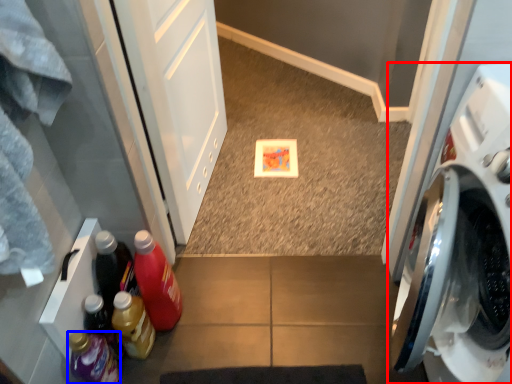
Question: Which object is further to the camera taking this photo, washing machine (highlighted by a red box) or bottle (highlighted by a blue box)?

Choices:
 (A) washing machine
 (B) bottle

Answer: (B)